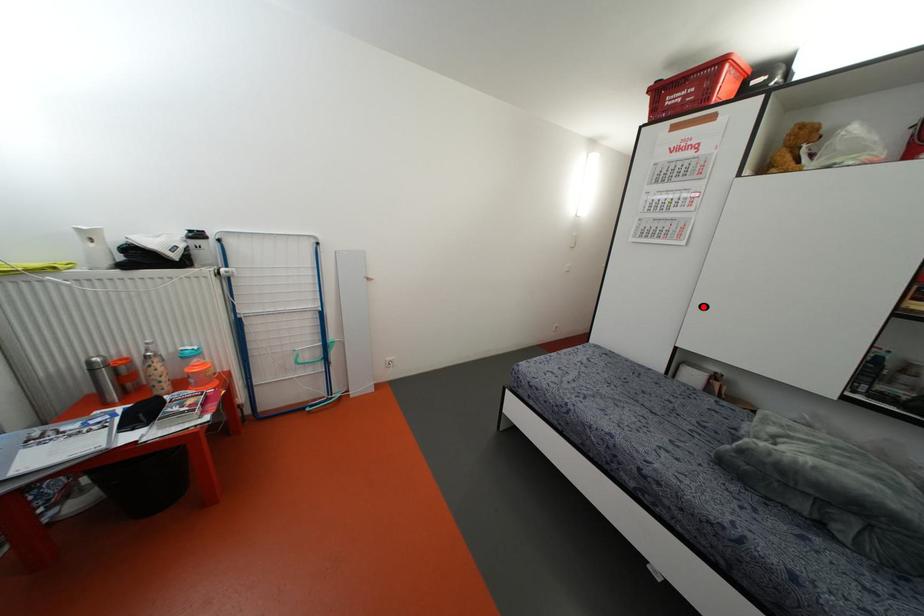
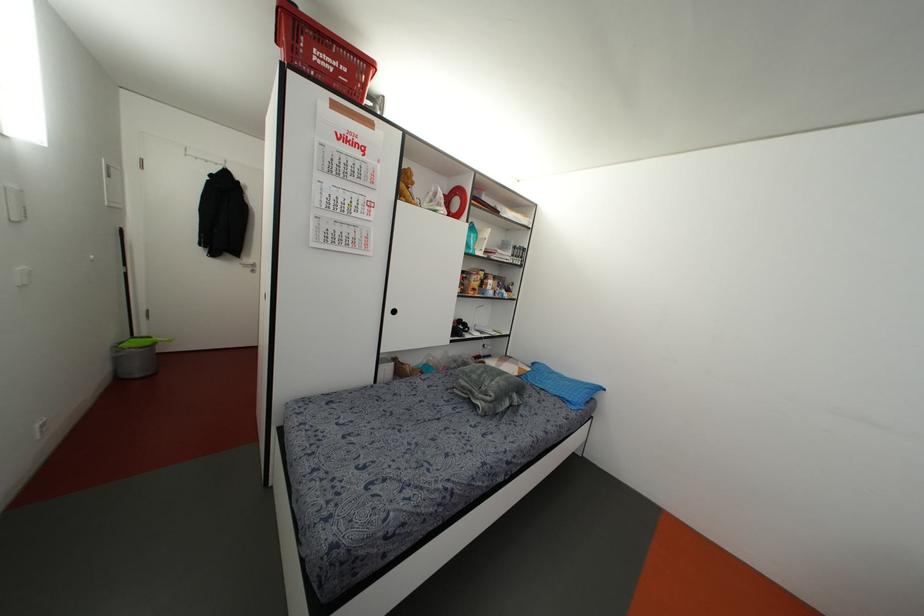
Find the pixel in the second image that matches the highlighted location in the first image.

(394, 310)